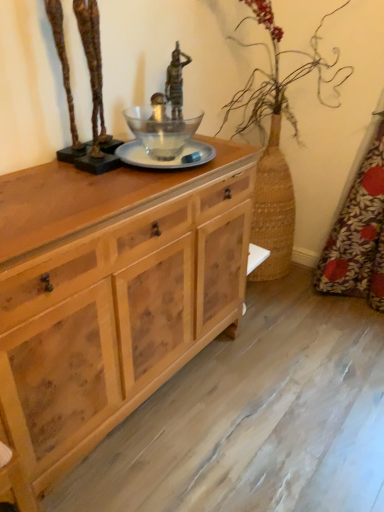
Where is `blank space situated above natural wood cabinet at center (from a real-world perspective)`? Image resolution: width=384 pixels, height=512 pixels. blank space situated above natural wood cabinet at center (from a real-world perspective) is located at coordinates (79, 187).